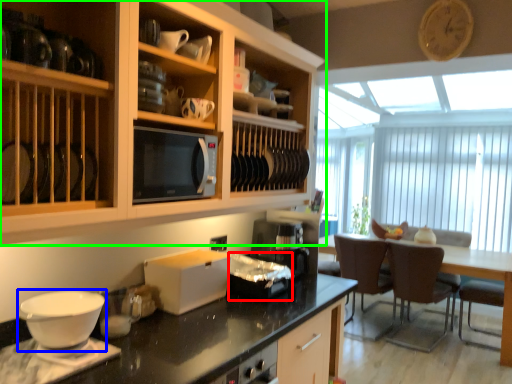
Question: Based on their relative distances, which object is farther from appliance (highlighted by a red box)? Choose from coffee cup (highlighted by a blue box) and cabinetry (highlighted by a green box).

Choices:
 (A) coffee cup
 (B) cabinetry

Answer: (A)